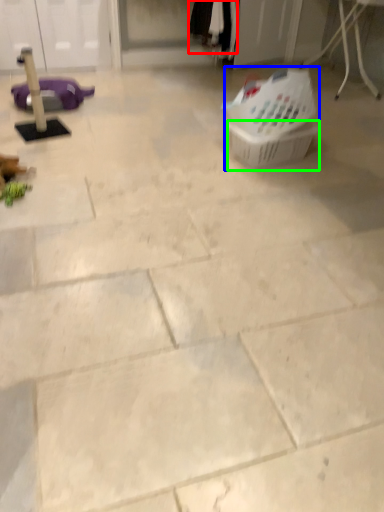
Question: Which is nearer to the clothing (highlighted by a red box)? basket (highlighted by a blue box) or basket (highlighted by a green box).

Choices:
 (A) basket
 (B) basket

Answer: (A)